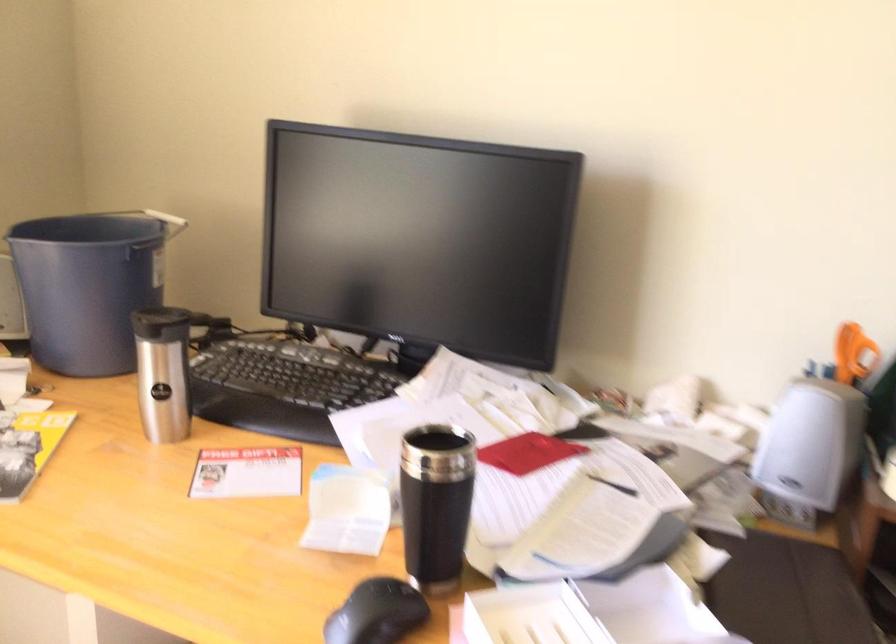
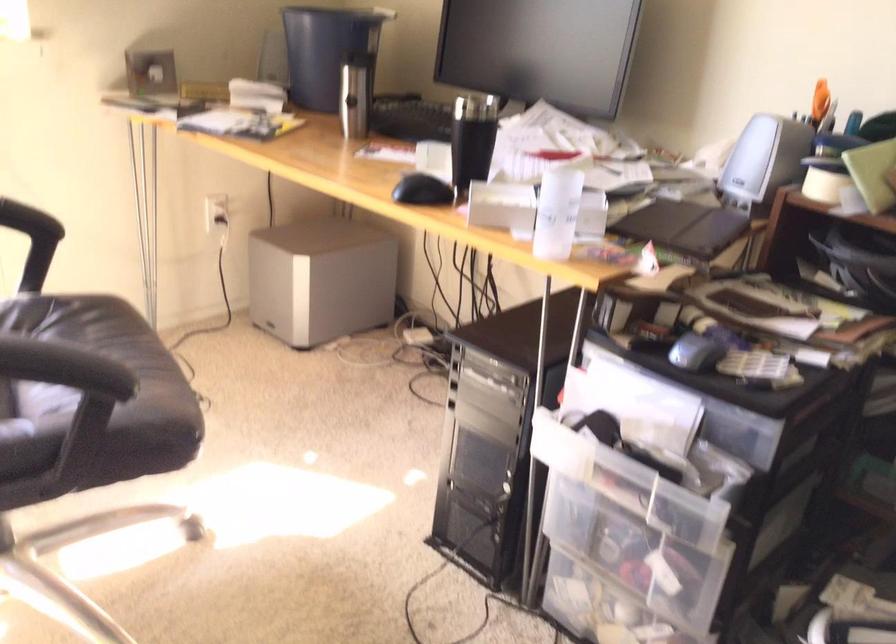
Question: The camera is either moving clockwise (left) or counter-clockwise (right) around the object. The first image is from the beginning of the video and the second image is from the end. Is the camera moving left or right when shooting the video?

Choices:
 (A) Left
 (B) Right

Answer: (B)